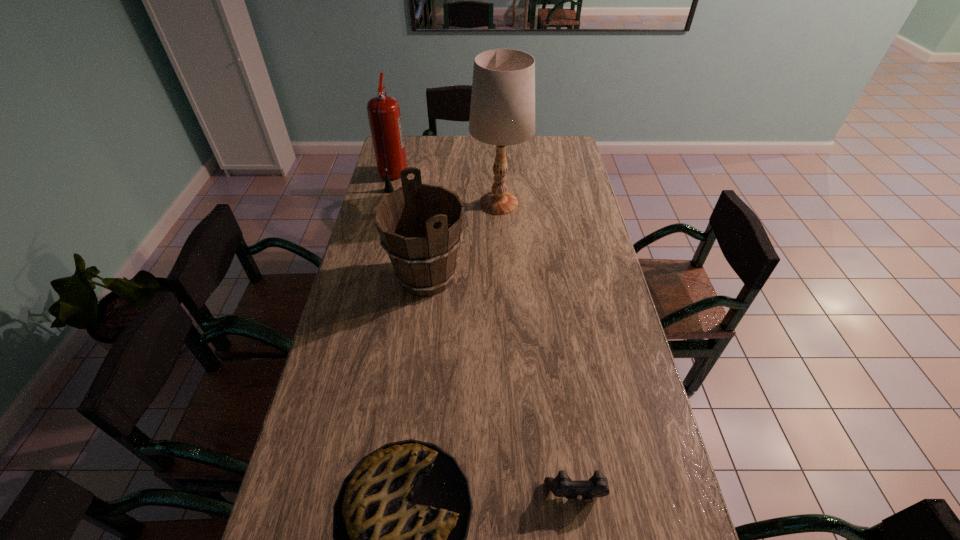
Identify the location of the tallest object. The height and width of the screenshot is (540, 960). (502, 112).

The image size is (960, 540). In order to click on fire extinguisher in this screenshot , I will do `click(384, 116)`.

Where is `the third farthest object`? This screenshot has height=540, width=960. the third farthest object is located at coordinates (420, 225).

This screenshot has height=540, width=960. In order to click on bucket in this screenshot , I will do `click(420, 225)`.

At what (x,y) coordinates should I click in order to perform the action: click on control. Please return your answer as a coordinate pair (x, y). Looking at the image, I should click on (561, 486).

Find the location of a particular element. free spot located on the front of the lamp is located at coordinates (503, 281).

You are a GUI agent. You are given a task and a screenshot of the screen. Output one action in this format:
    pyautogui.click(x=<x>, y=<y>)
    Task: Click on the vacant point located 0.400m on the instruction side of the fire extinguisher
    Image resolution: width=960 pixels, height=540 pixels.
    Given the screenshot: What is the action you would take?
    pyautogui.click(x=499, y=178)

I want to click on vacant space located on the front of the bucket, so click(x=421, y=324).

Locate an element on the screen. vacant space situated on the surface of the shortest object with buttons is located at coordinates (583, 537).

The width and height of the screenshot is (960, 540). Find the location of `fire extinguisher that is positioned at the left edge`. fire extinguisher that is positioned at the left edge is located at coordinates (384, 116).